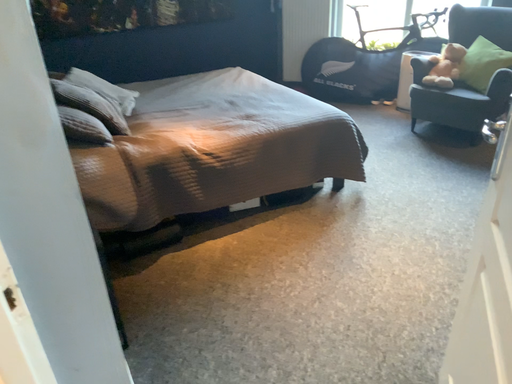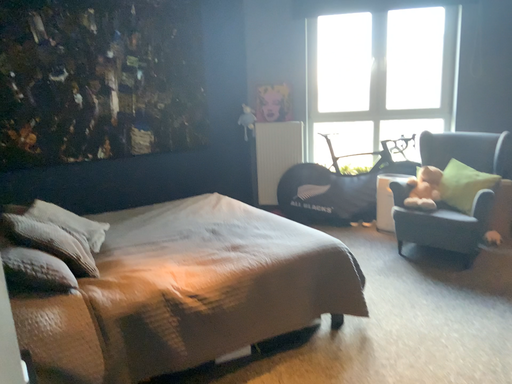
Question: How did the camera likely rotate when shooting the video?

Choices:
 (A) rotated upward
 (B) rotated downward

Answer: (A)